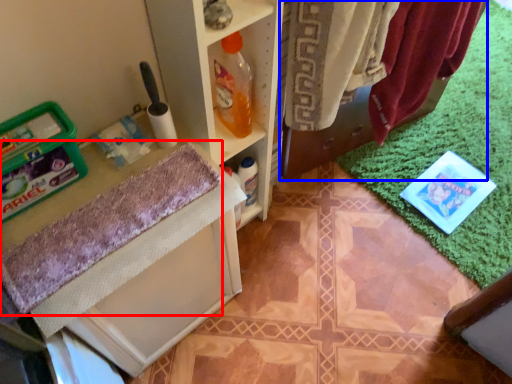
Question: Among these objects, which one is nearest to the camera, bath towel (highlighted by a red box) or laundry (highlighted by a blue box)?

Choices:
 (A) bath towel
 (B) laundry

Answer: (A)